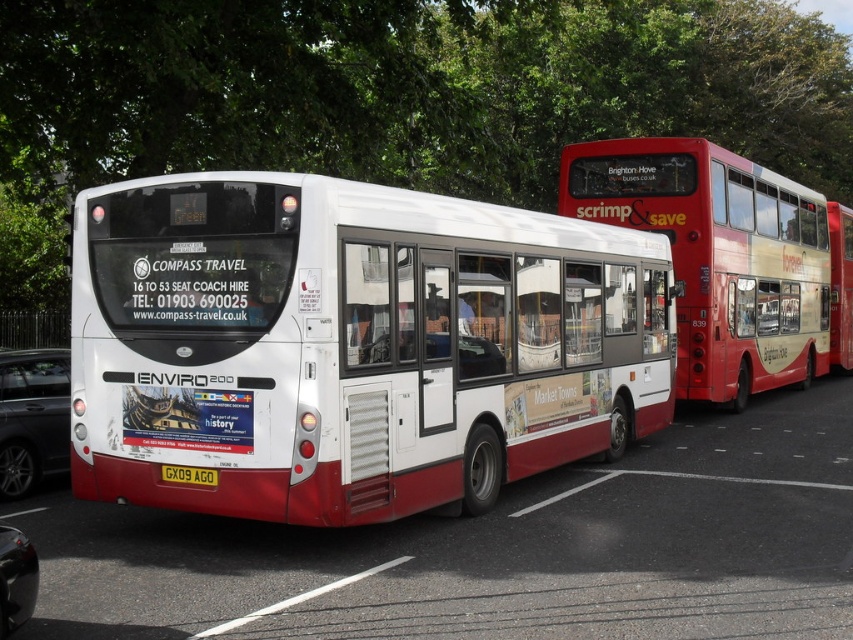
What are the coordinates of the metallic gray car at lower left?

The coordinates of the metallic gray car at lower left are at point (32, 417).